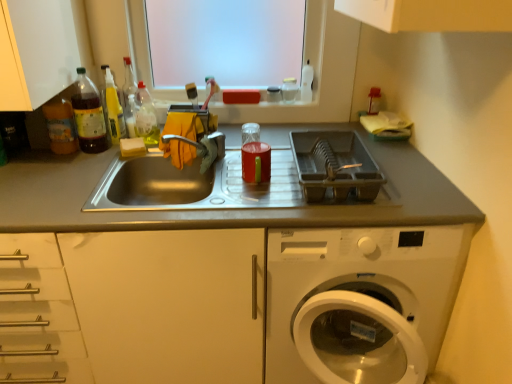
The width and height of the screenshot is (512, 384). I want to click on free spot in front of white sponge at sink left, so click(x=95, y=167).